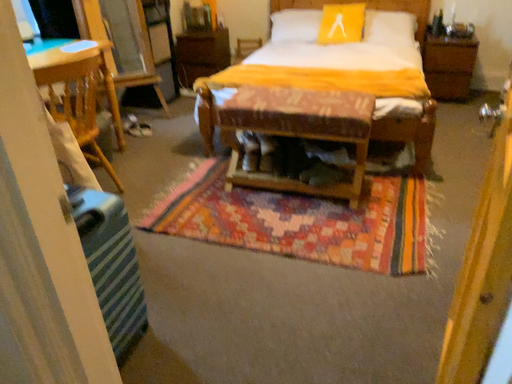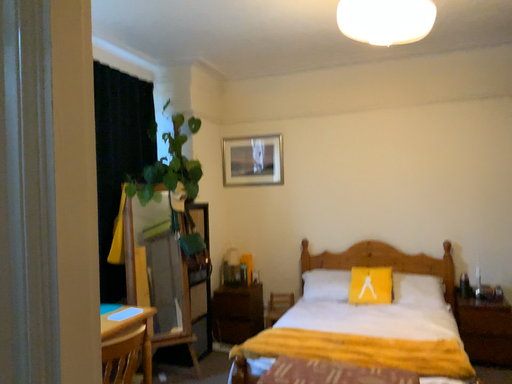
Question: How did the camera likely rotate when shooting the video?

Choices:
 (A) rotated upward
 (B) rotated downward

Answer: (A)